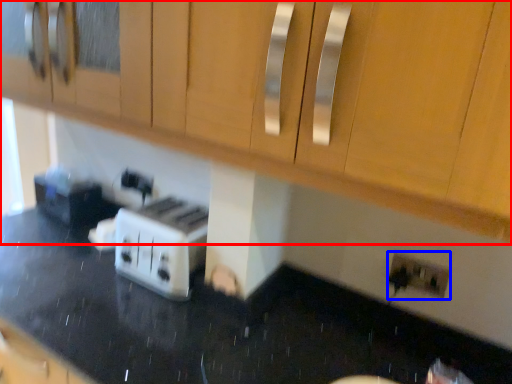
Question: Which of the following is the closest to the observer, cabinetry (highlighted by a red box) or electric outlet (highlighted by a blue box)?

Choices:
 (A) cabinetry
 (B) electric outlet

Answer: (A)